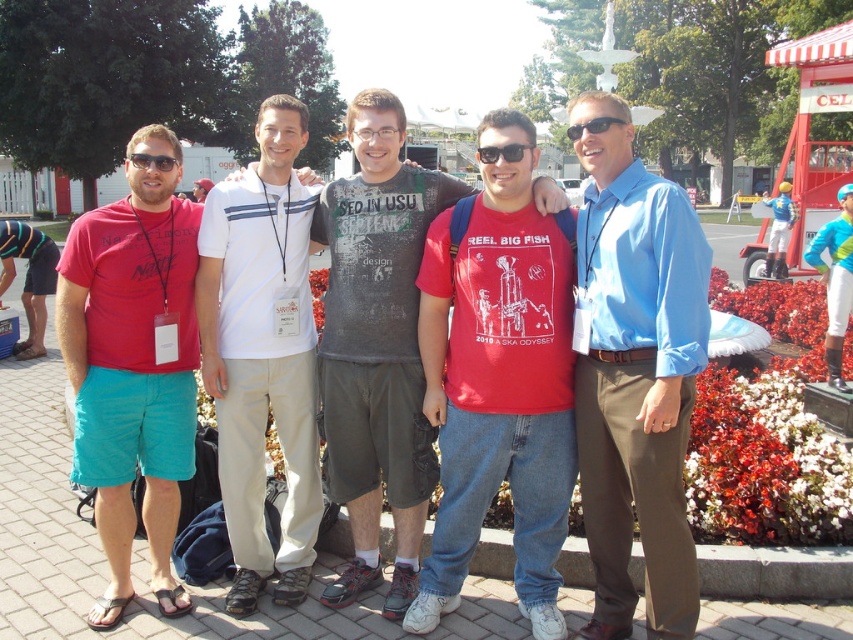
Does black plastic sunglasses at center appear over matte black sunglasses at left?

Incorrect, black plastic sunglasses at center is not positioned above matte black sunglasses at left.

Is black plastic sunglasses at center closer to the viewer compared to matte black sunglasses at left?

Yes.

What do you see at coordinates (502, 152) in the screenshot?
I see `black plastic sunglasses at center` at bounding box center [502, 152].

Image resolution: width=853 pixels, height=640 pixels. In order to click on black plastic sunglasses at center in this screenshot , I will do `click(502, 152)`.

Which of these two, red cotton t-shirt at center or blue smooth shirt at center, stands taller?

red cotton t-shirt at center is taller.

Can you confirm if red cotton t-shirt at center is positioned below blue smooth shirt at center?

No, red cotton t-shirt at center is not below blue smooth shirt at center.

Between point (490, 140) and point (613, 388), which one is positioned in front?

Positioned in front is point (613, 388).

Find the location of a particular element. red cotton t-shirt at center is located at coordinates (498, 392).

At what (x,y) coordinates should I click in order to perform the action: click on red cotton t-shirt at center. Please return your answer as a coordinate pair (x, y). The image size is (853, 640). Looking at the image, I should click on (498, 392).

This screenshot has width=853, height=640. Find the location of `red cotton t-shirt at center`. red cotton t-shirt at center is located at coordinates (498, 392).

This screenshot has height=640, width=853. I want to click on red cotton t-shirt at center, so click(x=498, y=392).